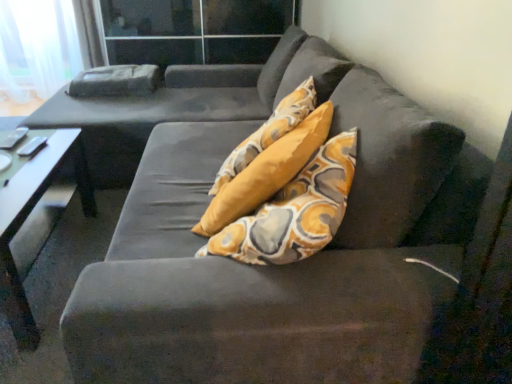
Question: Would you say transparent glass door at upper center is inside or outside smooth white table at left?

Choices:
 (A) outside
 (B) inside

Answer: (A)

Question: Considering the positions of transparent glass door at upper center and smooth white table at left in the image, is transparent glass door at upper center bigger or smaller than smooth white table at left?

Choices:
 (A) big
 (B) small

Answer: (A)

Question: From the image's perspective, is transparent glass door at upper center positioned above or below smooth white table at left?

Choices:
 (A) below
 (B) above

Answer: (B)

Question: Considering the relative positions of smooth white table at left and transparent glass door at upper center in the image provided, is smooth white table at left to the left or to the right of transparent glass door at upper center?

Choices:
 (A) right
 (B) left

Answer: (B)

Question: Is smooth white table at left wider or thinner than transparent glass door at upper center?

Choices:
 (A) wide
 (B) thin

Answer: (B)

Question: From the image's perspective, relative to transparent glass door at upper center, is smooth white table at left above or below?

Choices:
 (A) below
 (B) above

Answer: (A)

Question: Considering the positions of point (19, 193) and point (256, 36), is point (19, 193) closer or farther from the camera than point (256, 36)?

Choices:
 (A) farther
 (B) closer

Answer: (B)